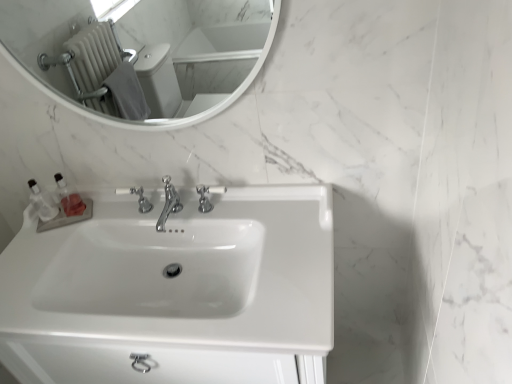
Where is `vacant area located to the right-hand side of polished chrome faucet at center, the 3th tap positioned from the left`? vacant area located to the right-hand side of polished chrome faucet at center, the 3th tap positioned from the left is located at coordinates (266, 217).